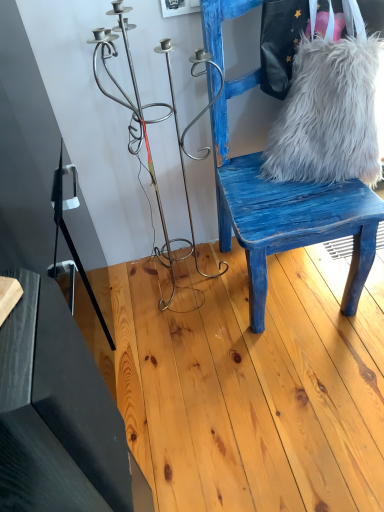
This screenshot has width=384, height=512. In order to click on white fluffy fur at right in this screenshot , I will do tap(328, 115).

In order to face white fluffy bag at right, should I rotate leftwards or rightwards?

It's best to rotate right around 17.119 degrees.

What do you see at coordinates (298, 35) in the screenshot? I see `white fluffy bag at right` at bounding box center [298, 35].

What is the approximate width of black matte table at lower left?

It is 39.67 centimeters.

This screenshot has height=512, width=384. Describe the element at coordinates (60, 416) in the screenshot. I see `black matte table at lower left` at that location.

This screenshot has width=384, height=512. Identify the location of white fluffy fur at right. (328, 115).

Is white fluffy bag at right far away from white fluffy fur at right?

No, white fluffy bag at right is not far away from white fluffy fur at right.

Where is `fur in front of the white fluffy bag at right`? Image resolution: width=384 pixels, height=512 pixels. fur in front of the white fluffy bag at right is located at coordinates (328, 115).

Can you confirm if white fluffy bag at right is shorter than white fluffy fur at right?

Yes, white fluffy bag at right is shorter than white fluffy fur at right.

From a real-world perspective, is white fluffy bag at right positioned above or below white fluffy fur at right?

From a real-world perspective, white fluffy bag at right is physically above white fluffy fur at right.

Is white fluffy fur at right far away from blue distressed wood chair at right?

No, there isn't a large distance between white fluffy fur at right and blue distressed wood chair at right.

How far apart are white fluffy fur at right and blue distressed wood chair at right?

They are 6.93 inches apart.

Which object is further away from the camera, white fluffy fur at right or blue distressed wood chair at right?

white fluffy fur at right is further away from the camera.

In terms of height, does white fluffy bag at right look taller or shorter compared to black matte table at lower left?

In the image, white fluffy bag at right appears to be shorter than black matte table at lower left.

Is white fluffy bag at right surrounding black matte table at lower left?

No, black matte table at lower left is not a part of white fluffy bag at right.

From the image's perspective, is white fluffy bag at right beneath black matte table at lower left?

No, from the image's perspective, white fluffy bag at right is not below black matte table at lower left.

From the image's perspective, does blue distressed wood chair at right appear higher than white fluffy fur at right?

Actually, blue distressed wood chair at right appears below white fluffy fur at right in the image.

Considering the relative sizes of blue distressed wood chair at right and white fluffy fur at right in the image provided, is blue distressed wood chair at right taller than white fluffy fur at right?

Correct, blue distressed wood chair at right is much taller as white fluffy fur at right.

Does blue distressed wood chair at right have a lesser width compared to white fluffy fur at right?

No, blue distressed wood chair at right is not thinner than white fluffy fur at right.

Which is correct: blue distressed wood chair at right is inside white fluffy fur at right, or outside of it?

blue distressed wood chair at right exists outside the volume of white fluffy fur at right.

Considering the sizes of objects white fluffy fur at right and black matte table at lower left in the image provided, who is wider, white fluffy fur at right or black matte table at lower left?

black matte table at lower left.

From the image's perspective, which one is positioned lower, white fluffy fur at right or black matte table at lower left?

black matte table at lower left.

Is white fluffy fur at right facing towards black matte table at lower left?

No, white fluffy fur at right is not aimed at black matte table at lower left.

From the picture: Considering the positions of objects blue distressed wood chair at right and black matte table at lower left in the image provided, who is in front, blue distressed wood chair at right or black matte table at lower left?

black matte table at lower left.

Does blue distressed wood chair at right have a greater height compared to black matte table at lower left?

Yes, blue distressed wood chair at right is taller than black matte table at lower left.

From a real-world perspective, is blue distressed wood chair at right physically located above or below black matte table at lower left?

blue distressed wood chair at right is situated higher than black matte table at lower left in the real world.

Is blue distressed wood chair at right not close to black matte table at lower left?

No, blue distressed wood chair at right is not far away from black matte table at lower left.

Consider the image. Measure the distance between white fluffy fur at right and white fluffy bag at right.

They are 13.75 centimeters apart.

Looking at the image, does white fluffy fur at right seem bigger or smaller compared to white fluffy bag at right?

Considering their sizes, white fluffy fur at right takes up more space than white fluffy bag at right.

How different are the orientations of white fluffy fur at right and white fluffy bag at right in degrees?

The angular difference between white fluffy fur at right and white fluffy bag at right is 0.000123 degrees.

Between white fluffy fur at right and white fluffy bag at right, which one appears on the left side from the viewer's perspective?

white fluffy bag at right.

I want to click on fur that appears on the right of white fluffy bag at right, so click(328, 115).

The image size is (384, 512). Find the location of `fur above the blue distressed wood chair at right (from the image's perspective)`. fur above the blue distressed wood chair at right (from the image's perspective) is located at coordinates (328, 115).

When comparing their distances from white fluffy fur at right, does white fluffy bag at right or black matte table at lower left seem further?

black matte table at lower left.

Considering their positions, is white fluffy fur at right positioned further to white fluffy bag at right than black matte table at lower left?

Among the two, black matte table at lower left is located further to white fluffy bag at right.

Based on their spatial positions, is white fluffy bag at right or blue distressed wood chair at right closer to white fluffy fur at right?

white fluffy bag at right.

From the image, which object appears to be nearer to blue distressed wood chair at right, white fluffy fur at right or black matte table at lower left?

white fluffy fur at right.

Based on their spatial positions, is blue distressed wood chair at right or white fluffy fur at right further from white fluffy bag at right?

blue distressed wood chair at right.

Considering their positions, is black matte table at lower left positioned further to blue distressed wood chair at right than white fluffy fur at right?

black matte table at lower left is further to blue distressed wood chair at right.

Looking at the image, which one is located further to black matte table at lower left, white fluffy bag at right or blue distressed wood chair at right?

Based on the image, white fluffy bag at right appears to be further to black matte table at lower left.

Based on their spatial positions, is blue distressed wood chair at right or black matte table at lower left further from white fluffy fur at right?

black matte table at lower left is positioned further to the anchor white fluffy fur at right.

Identify the location of chair between white fluffy fur at right and black matte table at lower left in the up-down direction. This screenshot has width=384, height=512. (286, 213).

Identify the location of chair between white fluffy bag at right and black matte table at lower left vertically. (286, 213).

You are a GUI agent. You are given a task and a screenshot of the screen. Output one action in this format:
    pyautogui.click(x=<x>, y=<y>)
    Task: Click on the fur between white fluffy bag at right and black matte table at lower left in the vertical direction
    
    Given the screenshot: What is the action you would take?
    pyautogui.click(x=328, y=115)

Find the location of a particular element. This screenshot has width=384, height=512. fur that lies between white fluffy bag at right and blue distressed wood chair at right from top to bottom is located at coordinates (328, 115).